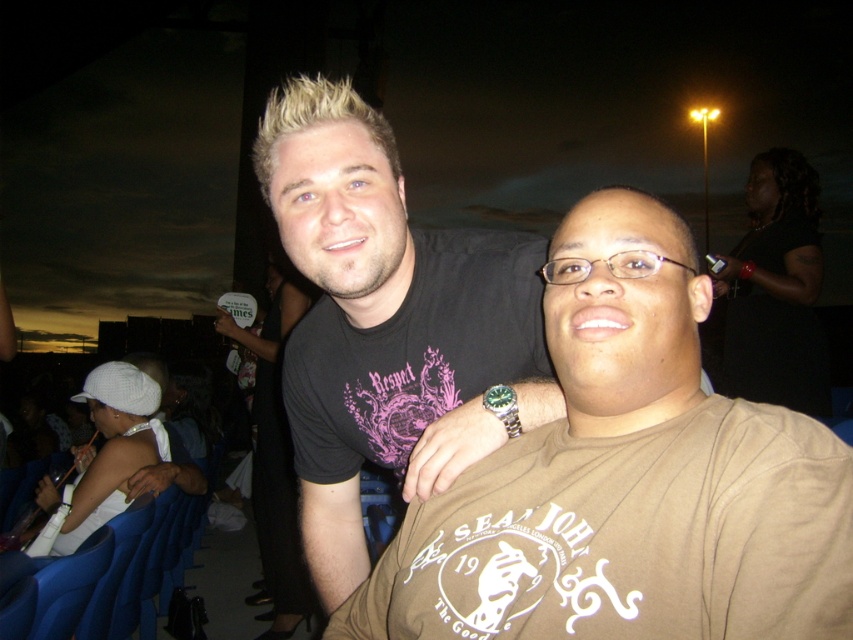
Does brown cotton t-shirt at center have a lesser width compared to black matte t-shirt at center?

Incorrect, brown cotton t-shirt at center's width is not less than black matte t-shirt at center's.

Who is more forward, [529,442] or [494,243]?

Point [529,442]

Who is more distant from viewer, (831, 632) or (389, 276)?

The point (389, 276) is more distant.

Find the location of a particular element. This screenshot has width=853, height=640. brown cotton t-shirt at center is located at coordinates (627, 480).